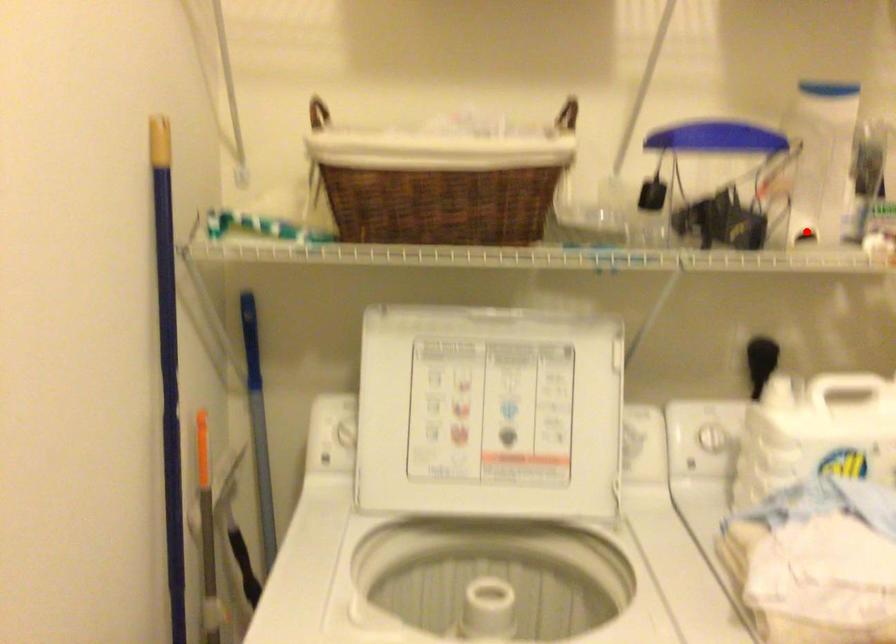
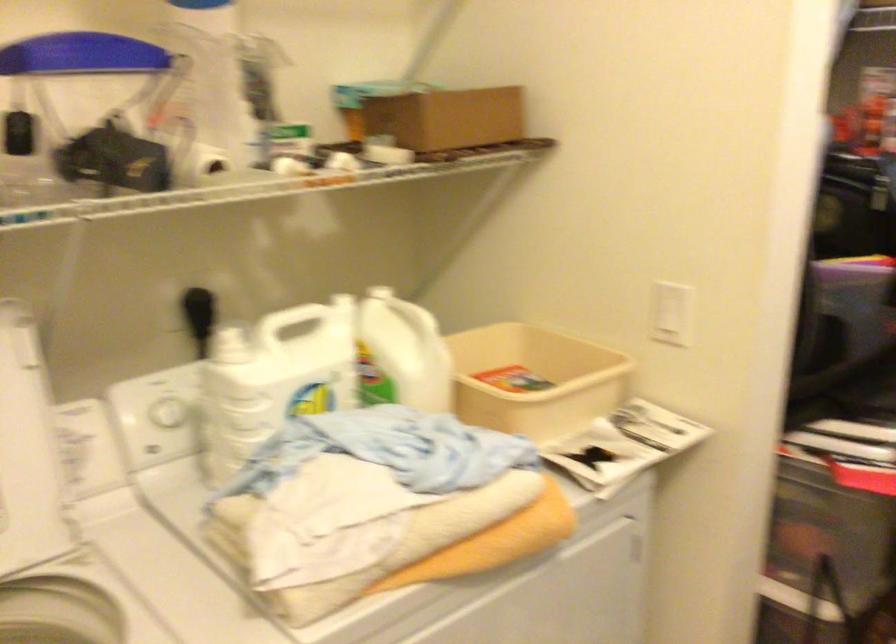
Question: I am providing you with two images of the same scene from different viewpoints. Image1 has a red point marked. In image2, the corresponding 3D location appears at what relative position? Reply with the corresponding letter.

Choices:
 (A) Closer
 (B) Farther

Answer: (A)